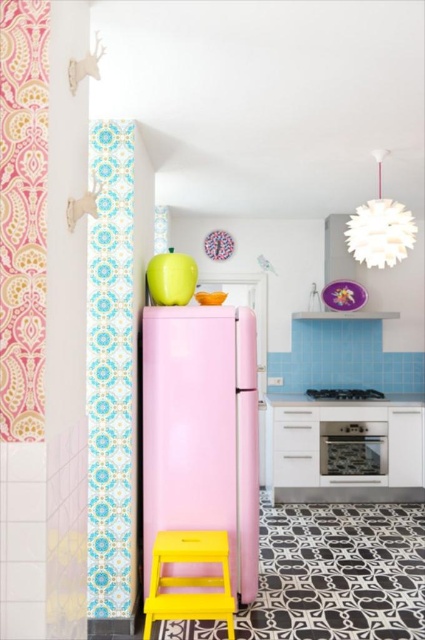
You are trying to clean the oven in the kitchen. You see the pink fabric curtain at left and the satin silver oven at center. Which object should you move first to access the oven?

The pink fabric curtain at left is in front of the satin silver oven at center, so you should move the pink fabric curtain at left first to access the oven.

You are standing in the kitchen and want to hang a new painting between the pink fabric curtain at left and the satin silver oven at center. Where should you place it so it is centered between them?

The painting should be placed between the pink fabric curtain at left and the satin silver oven at center, centered between them.

You are standing in the kitchen and need to place a new plant pot that requires a spot close to the yellow plastic stool at lower left. Based on the image, where should you position the plant pot to be near the stool?

The yellow plastic stool at lower left is located at point (x=189, y=579), so you should position the plant pot near those coordinates to be close to the stool.